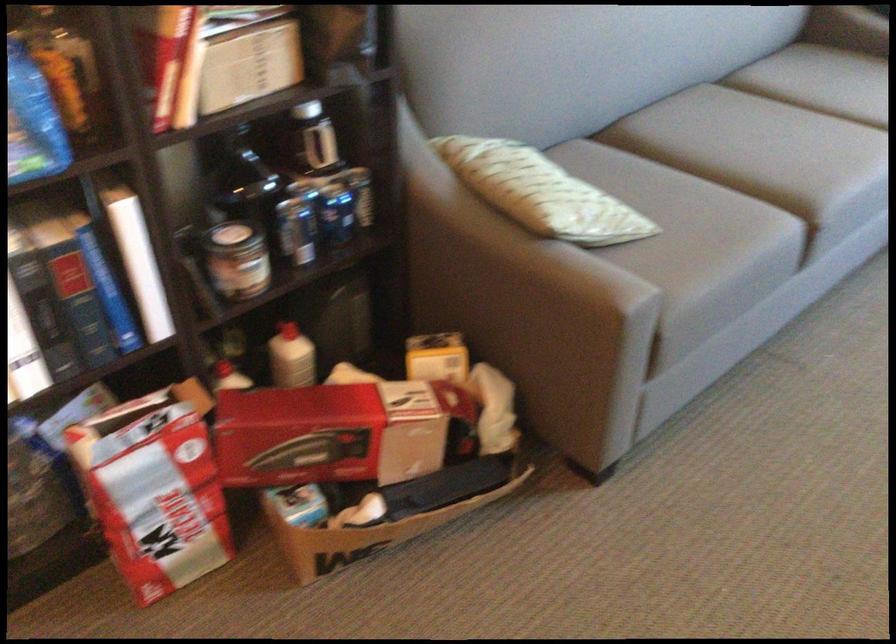
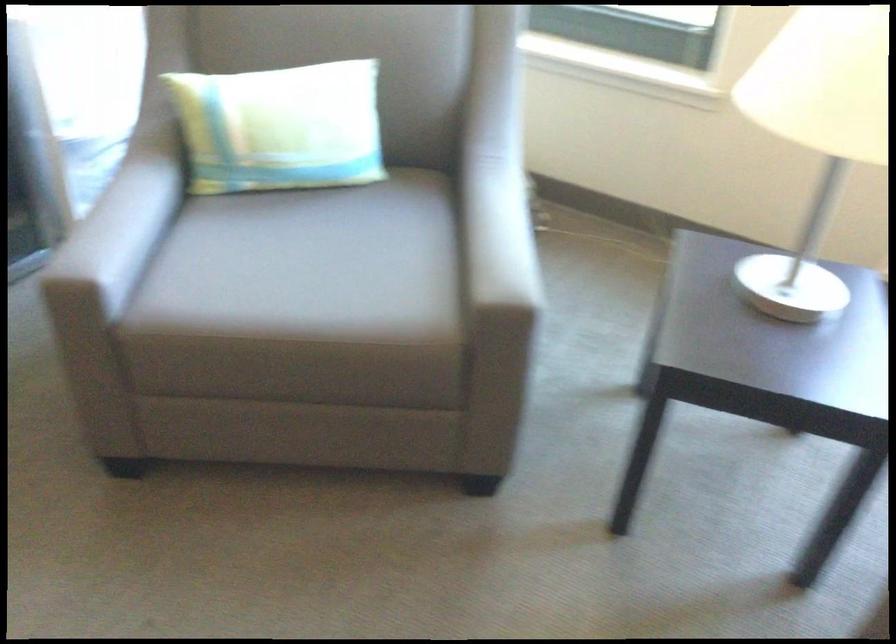
In a continuous first-person perspective shot, in which direction is the camera moving?

The cameraman walked toward right, forward.